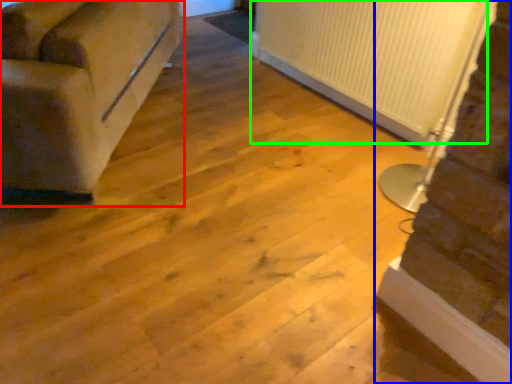
Question: Which object is positioned closest to studio couch (highlighted by a red box)? Select from stairwell (highlighted by a blue box) and radiator (highlighted by a green box).

Choices:
 (A) stairwell
 (B) radiator

Answer: (B)